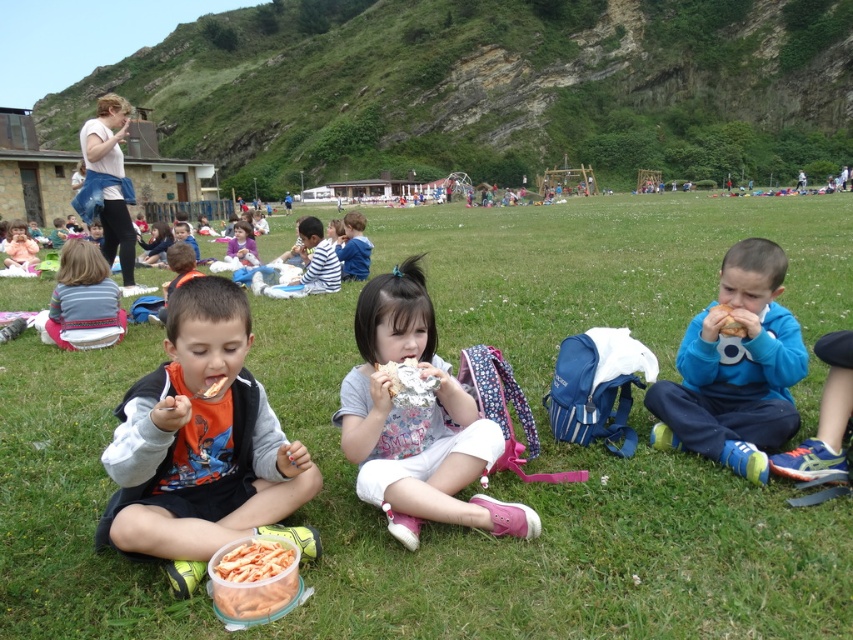
You are a photographer trying to capture a photo of the blue cotton shirt at center and the matte pink backpack at center. Since you want to ensure both are in focus, you need to know which object is taller. Can you tell me which one is taller?

The blue cotton shirt at center is taller than the matte pink backpack at center according to the description provided.